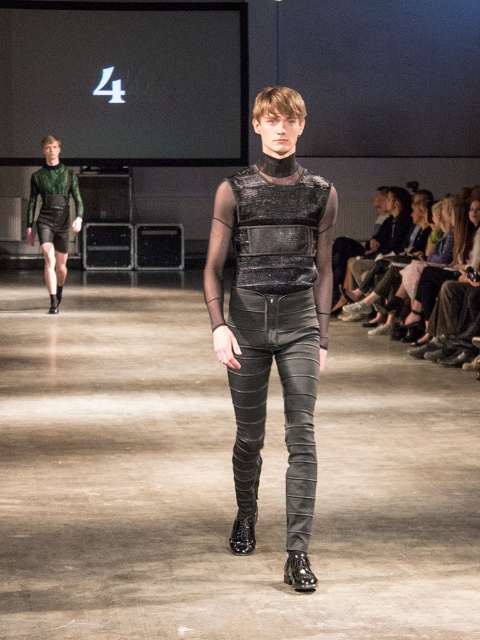
You are a photographer standing at the runway edge. You want to take a photo of the shiny black boot at center. Where should you aim your camera?

The shiny black boot at center is located at coordinate point [299,572]. Aim your camera there to capture it.

You are a photographer standing at the camera position. You want to capture a close shot of the male model wearing the sleeveless textured black top. The focus point is set to point (309, 452). Will the focus point be on the model?

The focus point set to point (309, 452) is 4.55 meters from the camera. Since the male model wearing the sleeveless textured black top is likely positioned at this distance, the focus point will be on him.